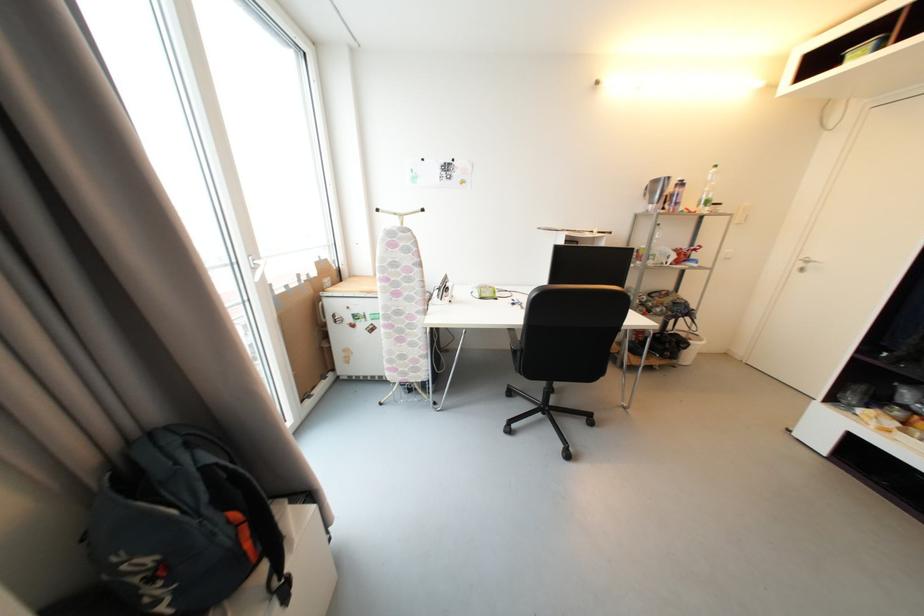
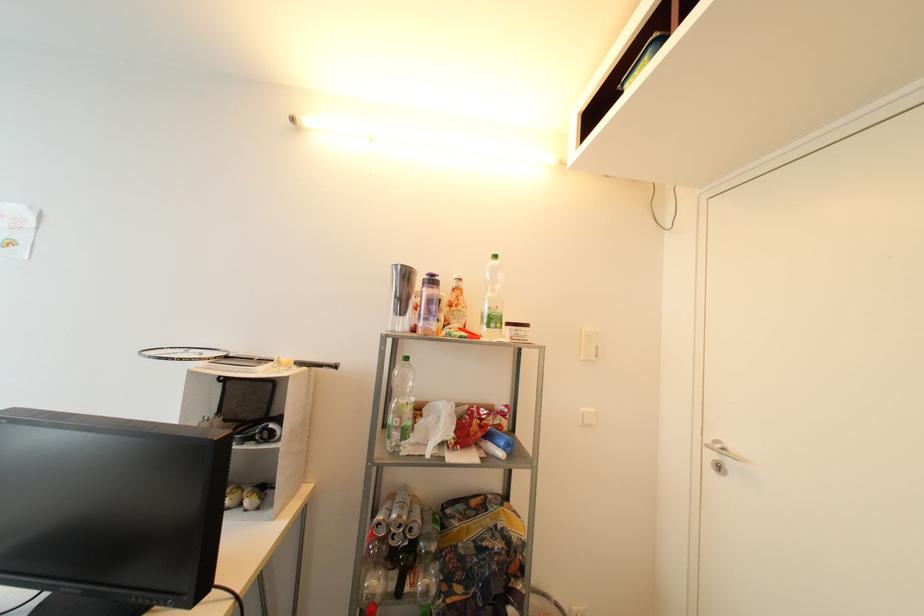
The point at (712, 204) is marked in the first image. Where is the corresponding point in the second image?

(499, 322)